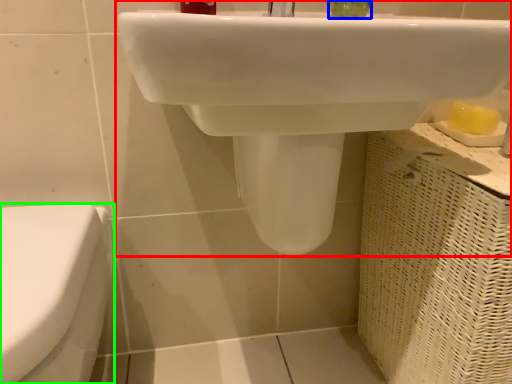
Question: Which object is positioned farthest from sink (highlighted by a red box)? Select from liquid (highlighted by a blue box) and toilet (highlighted by a green box).

Choices:
 (A) liquid
 (B) toilet

Answer: (A)